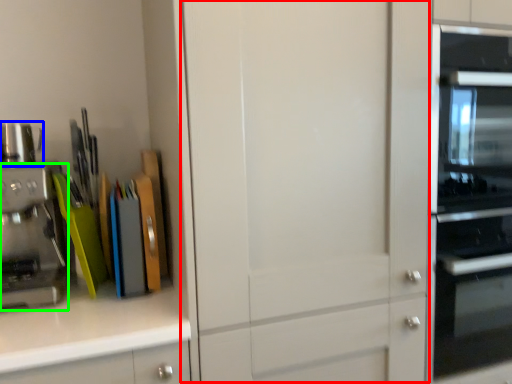
Question: Estimate the real-world distances between objects in this image. Which object is farther from glass door (highlighted by a red box), appliance (highlighted by a blue box) or kitchen appliance (highlighted by a green box)?

Choices:
 (A) appliance
 (B) kitchen appliance

Answer: (A)